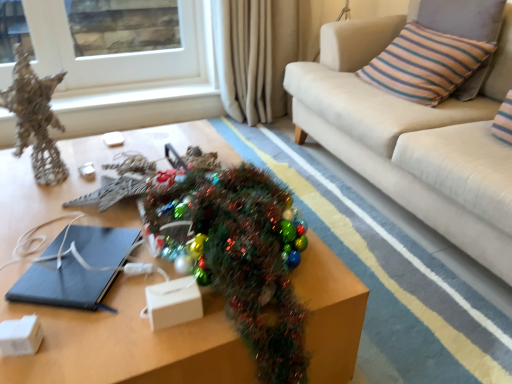
The image size is (512, 384). What do you see at coordinates (62, 285) in the screenshot?
I see `matte black notebook at center` at bounding box center [62, 285].

Where is `striped fabric pillow at upper right`? striped fabric pillow at upper right is located at coordinates (425, 64).

What do you see at coordinates (125, 342) in the screenshot? The image size is (512, 384). I see `metallic brown table at center` at bounding box center [125, 342].

This screenshot has width=512, height=384. I want to click on metallic wire sculpture at left, so click(x=35, y=118).

At what (x,y) coordinates should I click in order to perform the action: click on beige fabric curtain at upper center. Please return your answer as a coordinate pair (x, y). This screenshot has height=384, width=512. Looking at the image, I should click on (258, 54).

You are a GUI agent. You are given a task and a screenshot of the screen. Output one action in this format:
    pyautogui.click(x=<x>, y=<y>)
    Task: Click on the matte black notebook at center
    
    Given the screenshot: What is the action you would take?
    pyautogui.click(x=62, y=285)

Does point (125, 252) come behind point (468, 47)?

No, (125, 252) is closer to viewer.

Would you say matte black notebook at center contains striped fabric pillow at upper right?

No, striped fabric pillow at upper right is not surrounded by matte black notebook at center.

Is matte black notebook at center positioned with its back to striped fabric pillow at upper right?

No, matte black notebook at center is not facing the opposite direction of striped fabric pillow at upper right.

Considering the relative positions of metallic brown table at center and matte black notebook at center in the image provided, is metallic brown table at center in front of matte black notebook at center?

Yes, metallic brown table at center is closer to the viewer.

Which is correct: metallic brown table at center is inside matte black notebook at center, or outside of it?

The correct answer is: outside.

Is metallic brown table at center smaller than matte black notebook at center?

Incorrect, metallic brown table at center is not smaller in size than matte black notebook at center.

Considering the sizes of objects metallic brown table at center and matte black notebook at center in the image provided, who is taller, metallic brown table at center or matte black notebook at center?

metallic brown table at center is taller.

Can you confirm if metallic wire sculpture at left is taller than beige fabric curtain at upper center?

In fact, metallic wire sculpture at left may be shorter than beige fabric curtain at upper center.

Is metallic wire sculpture at left next to beige fabric curtain at upper center and touching it?

No, metallic wire sculpture at left is not in contact with beige fabric curtain at upper center.

Is point (49, 146) closer to camera compared to point (243, 50)?

Yes, point (49, 146) is closer to viewer.

Does metallic wire sculpture at left turn towards beige fabric curtain at upper center?

No, metallic wire sculpture at left is not facing towards beige fabric curtain at upper center.

Is white glass window at upper left facing away from metallic wire sculpture at left?

No, white glass window at upper left is not facing the opposite direction of metallic wire sculpture at left.

Can you confirm if white glass window at upper left is positioned to the left of metallic wire sculpture at left?

Indeed, white glass window at upper left is positioned on the left side of metallic wire sculpture at left.

Does white glass window at upper left have a greater height compared to metallic wire sculpture at left?

Correct, white glass window at upper left is much taller as metallic wire sculpture at left.

Are white glass window at upper left and metallic wire sculpture at left located far from each other?

Yes, white glass window at upper left and metallic wire sculpture at left are located far from each other.

Is matte black notebook at center inside the boundaries of metallic wire sculpture at left, or outside?

matte black notebook at center is outside metallic wire sculpture at left.

Which object is closer to the camera, matte black notebook at center or metallic wire sculpture at left?

Positioned in front is matte black notebook at center.

Would you say matte black notebook at center is a long distance from metallic wire sculpture at left?

No, matte black notebook at center is not far away from metallic wire sculpture at left.

Considering the relative positions of matte black notebook at center and metallic wire sculpture at left in the image provided, is matte black notebook at center to the right of metallic wire sculpture at left from the viewer's perspective?

Yes.

Where is `studio couch located above the beige fabric curtain at upper center (from a real-world perspective)`? This screenshot has width=512, height=384. studio couch located above the beige fabric curtain at upper center (from a real-world perspective) is located at coordinates (414, 137).

Considering the relative sizes of beige fabric curtain at upper center and beige fabric couch at upper right in the image provided, is beige fabric curtain at upper center shorter than beige fabric couch at upper right?

Yes.

Is beige fabric curtain at upper center in front of beige fabric couch at upper right?

No.

Considering the sizes of objects beige fabric couch at upper right and matte black notebook at center in the image provided, who is thinner, beige fabric couch at upper right or matte black notebook at center?

With smaller width is matte black notebook at center.

Between beige fabric couch at upper right and matte black notebook at center, which one is positioned behind?

matte black notebook at center.

From the image's perspective, is beige fabric couch at upper right above or below matte black notebook at center?

Clearly, from the image's perspective, beige fabric couch at upper right is above matte black notebook at center.

Find the location of a particular element. pillow that appears behind the matte black notebook at center is located at coordinates (425, 64).

The height and width of the screenshot is (384, 512). What are the coordinates of `notebook above the metallic brown table at center (from the image's perspective)` in the screenshot? It's located at (62, 285).

When comparing their distances from metallic brown table at center, does matte black notebook at center or metallic wire sculpture at left seem closer?

Among the two, matte black notebook at center is located nearer to metallic brown table at center.

Estimate the real-world distances between objects in this image. Which object is closer to striped fabric pillow at upper right, white glass window at upper left or metallic wire sculpture at left?

The object closer to striped fabric pillow at upper right is white glass window at upper left.

Looking at the image, which one is located further to shiny metallic christmas tree at center, beige fabric couch at upper right or white glass window at upper left?

white glass window at upper left lies further to shiny metallic christmas tree at center than the other object.

From the image, which object appears to be farther from shiny metallic christmas tree at center, metallic wire sculpture at left or metallic brown table at center?

The object further to shiny metallic christmas tree at center is metallic wire sculpture at left.

Considering their positions, is metallic brown table at center positioned further to beige fabric curtain at upper center than striped fabric pillow at upper right?

metallic brown table at center.

Looking at the image, which one is located further to metallic wire sculpture at left, striped fabric pillow at upper right or white glass window at upper left?

striped fabric pillow at upper right.

Looking at the image, which one is located further to shiny metallic christmas tree at center, matte black notebook at center or beige fabric curtain at upper center?

The object further to shiny metallic christmas tree at center is beige fabric curtain at upper center.

Based on their spatial positions, is shiny metallic christmas tree at center or metallic wire sculpture at left closer to metallic brown table at center?

Based on the image, shiny metallic christmas tree at center appears to be nearer to metallic brown table at center.

Image resolution: width=512 pixels, height=384 pixels. I want to click on curtain located between metallic wire sculpture at left and striped fabric pillow at upper right in the left-right direction, so click(x=258, y=54).

The width and height of the screenshot is (512, 384). I want to click on pillow between matte black notebook at center and beige fabric curtain at upper center along the z-axis, so click(x=425, y=64).

Where is `decor between shiny metallic christmas tree at center and beige fabric curtain at upper center in the front-back direction`? This screenshot has height=384, width=512. decor between shiny metallic christmas tree at center and beige fabric curtain at upper center in the front-back direction is located at coordinates click(x=35, y=118).

At what (x,y) coordinates should I click in order to perform the action: click on notebook positioned between shiny metallic christmas tree at center and beige fabric curtain at upper center from near to far. Please return your answer as a coordinate pair (x, y). This screenshot has width=512, height=384. Looking at the image, I should click on (x=62, y=285).